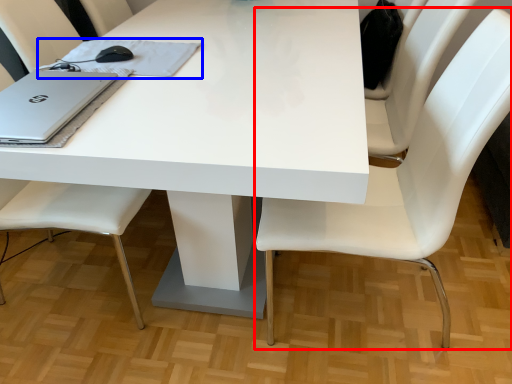
Question: Among these objects, which one is farthest to the camera, chair (highlighted by a red box) or notebook (highlighted by a blue box)?

Choices:
 (A) chair
 (B) notebook

Answer: (B)